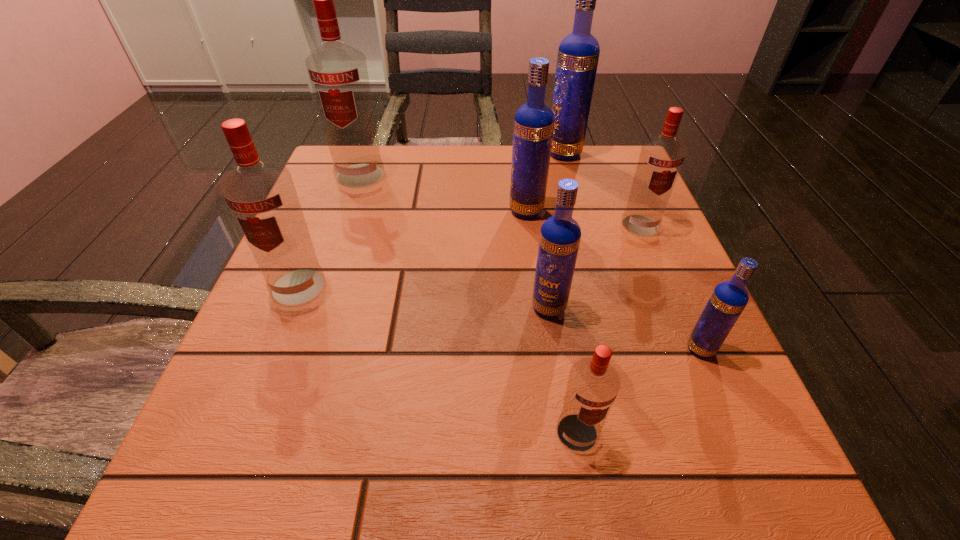
The height and width of the screenshot is (540, 960). In order to click on object positioned at the near edge in this screenshot , I will do `click(593, 384)`.

The height and width of the screenshot is (540, 960). I want to click on object positioned at the far left corner, so click(x=338, y=73).

You are a GUI agent. You are given a task and a screenshot of the screen. Output one action in this format:
    pyautogui.click(x=<x>, y=<y>)
    Task: Click on the object located in the far right corner section of the desktop
    The height and width of the screenshot is (540, 960).
    Given the screenshot: What is the action you would take?
    pyautogui.click(x=578, y=54)

Where is `vacant region at the far edge of the desktop`? vacant region at the far edge of the desktop is located at coordinates (442, 148).

This screenshot has width=960, height=540. I want to click on free space at the near edge of the desktop, so click(564, 494).

Where is `blank space at the left edge`? The image size is (960, 540). blank space at the left edge is located at coordinates (x=322, y=245).

Identify the location of free region at the right edge. (615, 324).

In order to click on free space at the far left corner of the desktop in this screenshot , I will do `click(389, 155)`.

The width and height of the screenshot is (960, 540). In the image, there is a desktop. In order to click on vacant space at the near left corner in this screenshot , I will do `click(192, 447)`.

Locate an element on the screen. This screenshot has height=540, width=960. vacant space at the far right corner of the desktop is located at coordinates (602, 184).